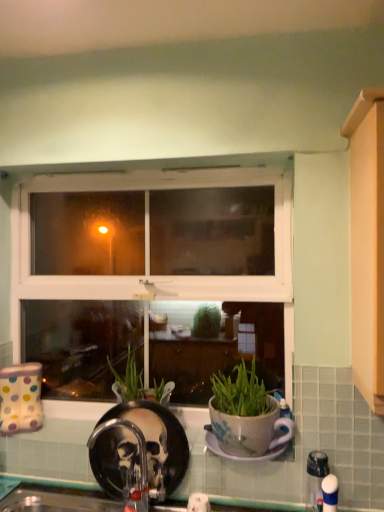
Question: Considering the relative positions of white plastic faucet at lower right, arranged as the 2th faucet when viewed from the back, and black matte faucet at lower center, the 2th faucet positioned from the right, in the image provided, is white plastic faucet at lower right, arranged as the 2th faucet when viewed from the back, in front of black matte faucet at lower center, the 2th faucet positioned from the right,?

Choices:
 (A) yes
 (B) no

Answer: (A)

Question: Is white plastic faucet at lower right, acting as the 1th faucet starting from the right, oriented towards black matte faucet at lower center, the 1th faucet from the back?

Choices:
 (A) yes
 (B) no

Answer: (B)

Question: Is black matte faucet at lower center, the 1th faucet from the back, at the back of white plastic faucet at lower right, the second faucet viewed from the left?

Choices:
 (A) yes
 (B) no

Answer: (B)

Question: From the image's perspective, is white plastic faucet at lower right, arranged as the 2th faucet when viewed from the back, under black matte faucet at lower center, the second faucet when ordered from front to back?

Choices:
 (A) yes
 (B) no

Answer: (A)

Question: Is black matte faucet at lower center, the 1th faucet from the back, surrounded by white plastic faucet at lower right, the second faucet viewed from the left?

Choices:
 (A) no
 (B) yes

Answer: (A)

Question: From a real-world perspective, is white plastic window at center positioned above or below porcelain plate at center?

Choices:
 (A) below
 (B) above

Answer: (B)

Question: Does point (84, 278) appear closer or farther from the camera than point (254, 459)?

Choices:
 (A) closer
 (B) farther

Answer: (B)

Question: In terms of height, does white plastic window at center look taller or shorter compared to porcelain plate at center?

Choices:
 (A) short
 (B) tall

Answer: (B)

Question: Looking at their shapes, would you say white plastic window at center is wider or thinner than porcelain plate at center?

Choices:
 (A) wide
 (B) thin

Answer: (B)

Question: From a real-world perspective, is porcelain plate at center physically located above or below black matte faucet at lower center, the 1th faucet positioned from the left?

Choices:
 (A) above
 (B) below

Answer: (A)

Question: Is point (203, 425) closer or farther from the camera than point (89, 446)?

Choices:
 (A) closer
 (B) farther

Answer: (B)

Question: Considering the relative positions of porcelain plate at center and black matte faucet at lower center, the second faucet when ordered from front to back, in the image provided, is porcelain plate at center to the left or to the right of black matte faucet at lower center, the second faucet when ordered from front to back,?

Choices:
 (A) left
 (B) right

Answer: (B)

Question: From the image's perspective, is porcelain plate at center located above or below black matte faucet at lower center, the second faucet when ordered from front to back?

Choices:
 (A) below
 (B) above

Answer: (B)

Question: Considering the relative positions of black matte faucet at lower center, the second faucet when ordered from front to back, and porcelain plate at center in the image provided, is black matte faucet at lower center, the second faucet when ordered from front to back, to the left or to the right of porcelain plate at center?

Choices:
 (A) right
 (B) left

Answer: (B)

Question: Looking at their shapes, would you say black matte faucet at lower center, the 2th faucet positioned from the right, is wider or thinner than porcelain plate at center?

Choices:
 (A) wide
 (B) thin

Answer: (B)